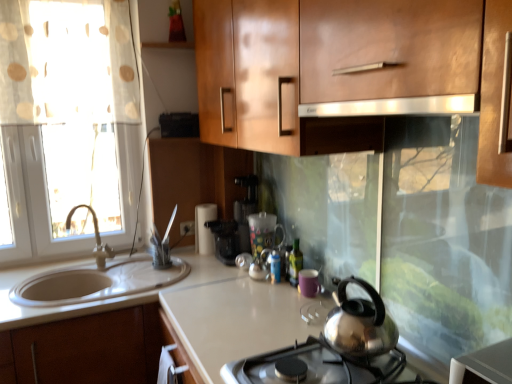
This screenshot has height=384, width=512. I want to click on vacant space situated on the left part of black plastic coffee machine at center, so click(x=198, y=262).